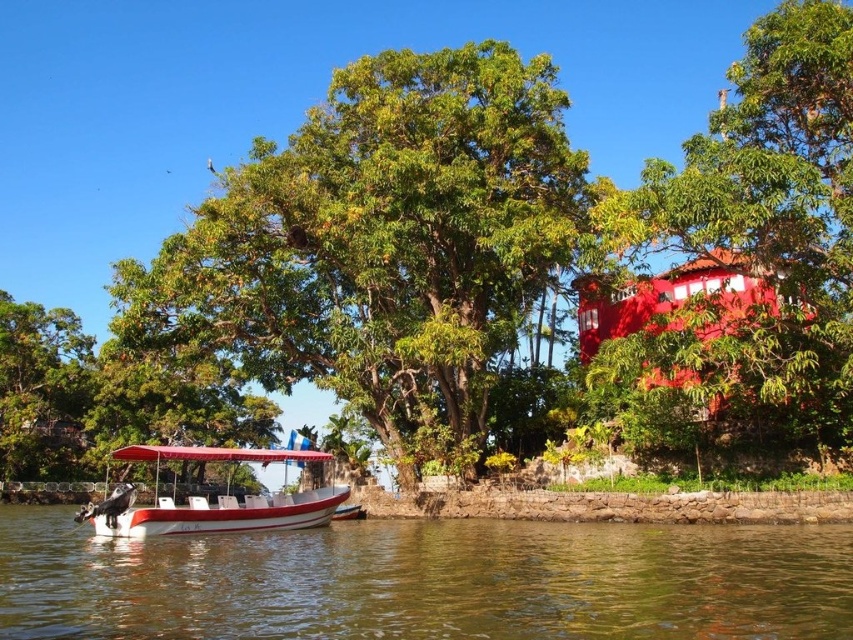
Question: Based on their relative distances, which object is nearer to the green leafy tree at upper right?

Choices:
 (A) green leafy tree at center
 (B) white glossy boat at lower left
 (C) greenish-brown water at lower center

Answer: (C)

Question: Which point appears farthest from the camera in this image?

Choices:
 (A) (799, 310)
 (B) (38, 621)
 (C) (344, 230)

Answer: (C)

Question: Which is nearer to the green leafy tree at upper right?

Choices:
 (A) greenish-brown water at lower center
 (B) white glossy boat at lower left
 (C) green leafy tree at center

Answer: (A)

Question: Can you confirm if green leafy tree at center is smaller than white glossy boat at lower left?

Choices:
 (A) yes
 (B) no

Answer: (A)

Question: Is green leafy tree at upper right above white glossy boat at lower left?

Choices:
 (A) yes
 (B) no

Answer: (A)

Question: Is green leafy tree at center closer to camera compared to green leafy tree at upper right?

Choices:
 (A) no
 (B) yes

Answer: (A)